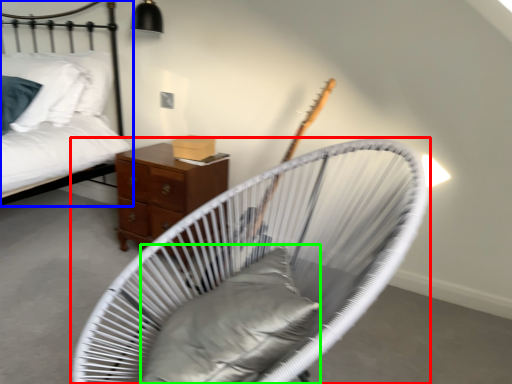
Question: Which is farther away from furniture (highlighted by a red box)? bed (highlighted by a blue box) or pillow (highlighted by a green box)?

Choices:
 (A) bed
 (B) pillow

Answer: (A)